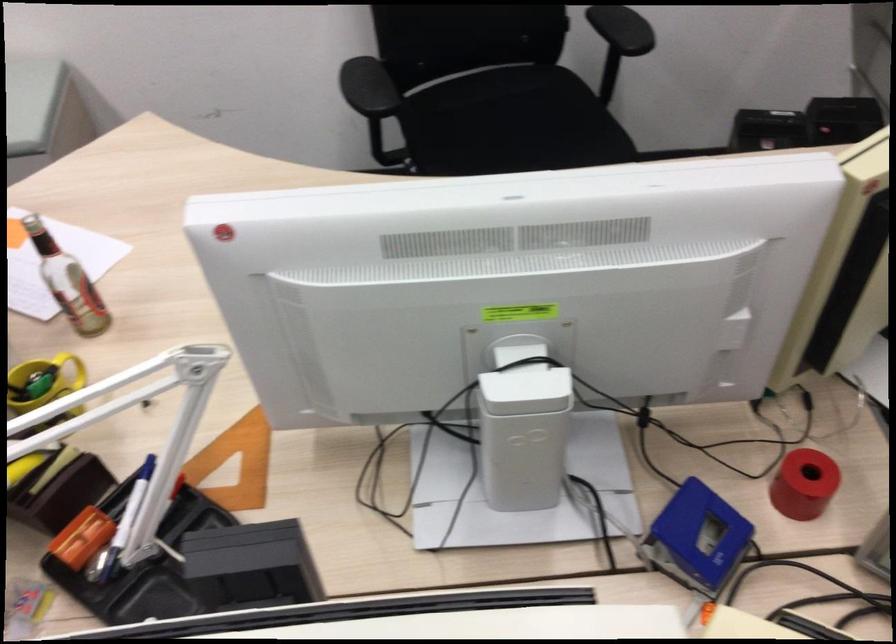
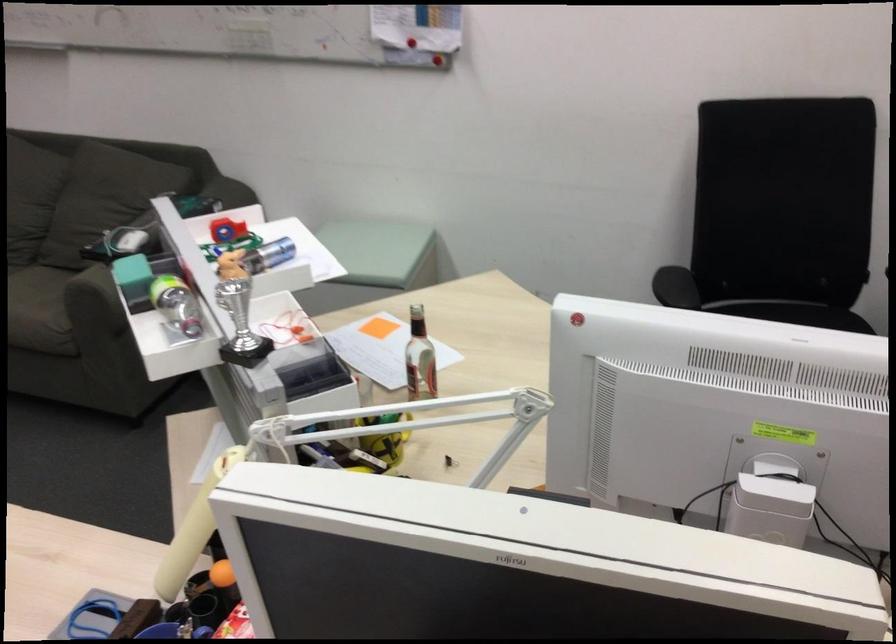
Question: What movement of the cameraman would produce the second image?

Choices:
 (A) Left
 (B) Right
 (C) Forward
 (D) Backward

Answer: (D)